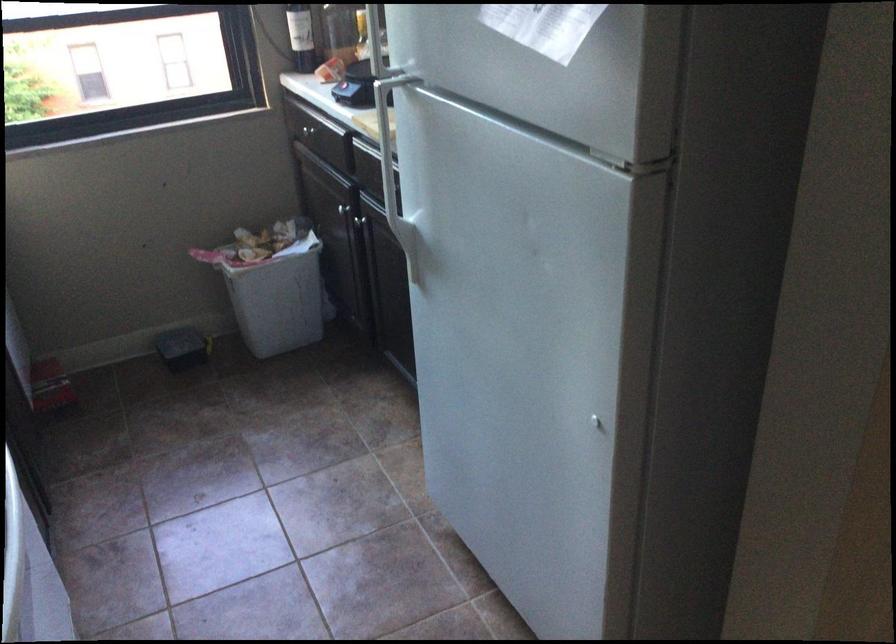
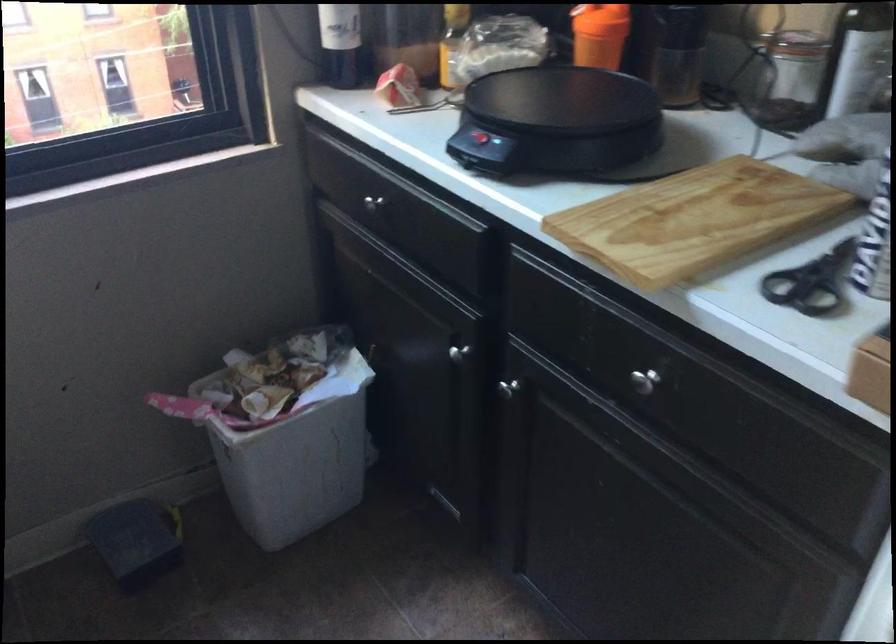
Where in the second image is the point corresponding to (272,287) from the first image?

(296, 456)